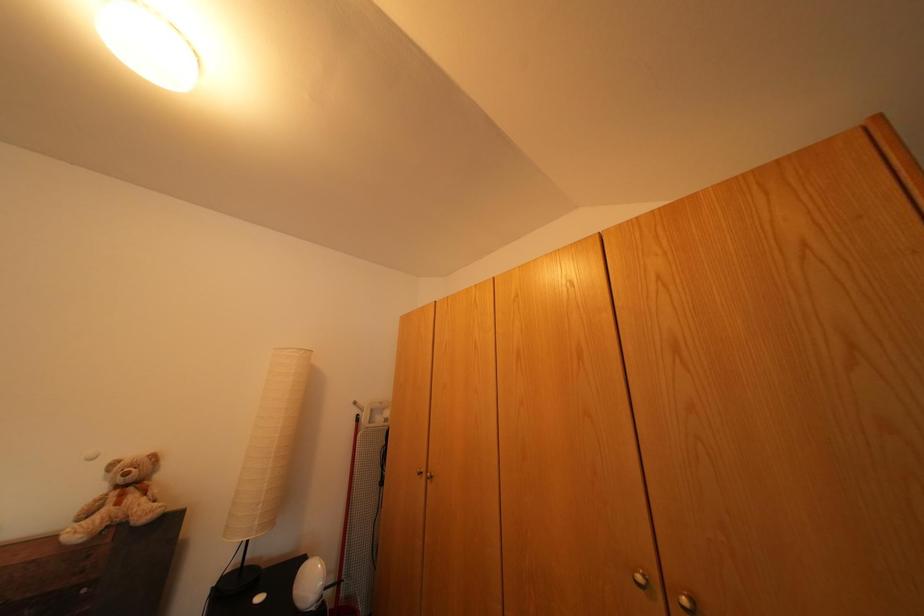
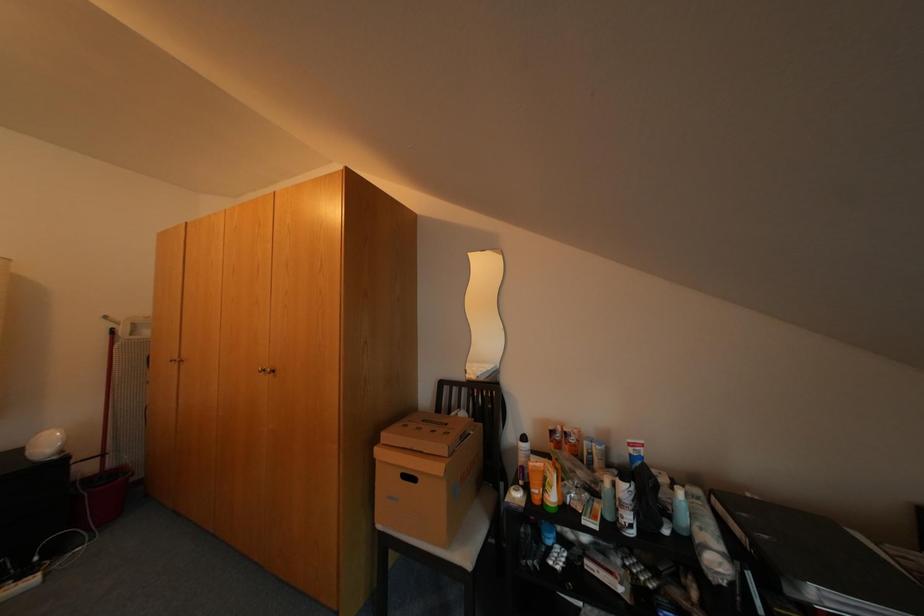
In the scene shown: Which direction would the cameraman need to move to produce the second image?

The cameraman moved toward right, backward.